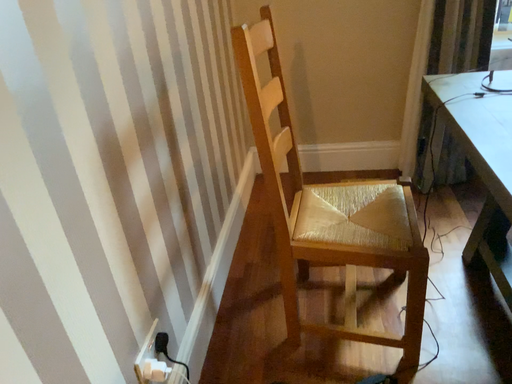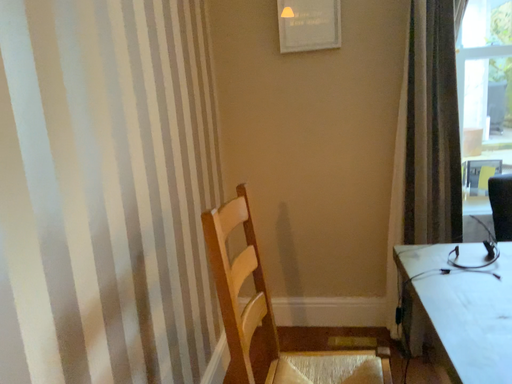
Question: How did the camera likely rotate when shooting the video?

Choices:
 (A) rotated upward
 (B) rotated downward

Answer: (A)